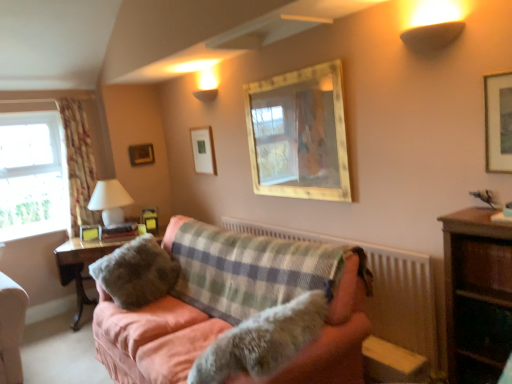
Locate an element on the screen. free location above wooden bookshelf at right, the 1th table from the right (from a real-world perspective) is located at coordinates (482, 216).